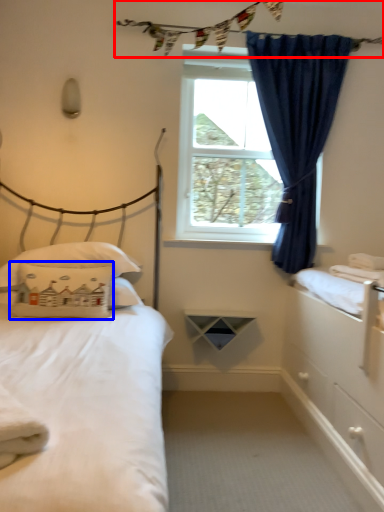
Question: Which object appears closest to the camera in this image, clothesline (highlighted by a red box) or pillow (highlighted by a blue box)?

Choices:
 (A) clothesline
 (B) pillow

Answer: (B)